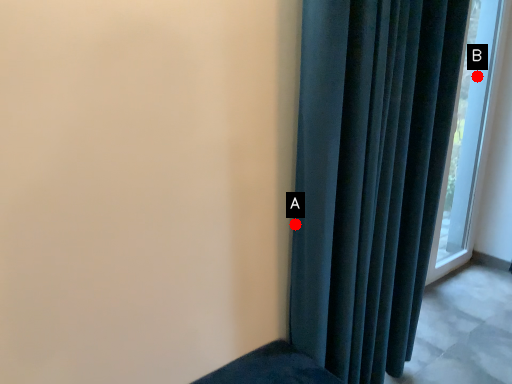
Question: Two points are circled on the image, labeled by A and B beside each circle. Which point is closer to the camera?

Choices:
 (A) A is closer
 (B) B is closer

Answer: (A)